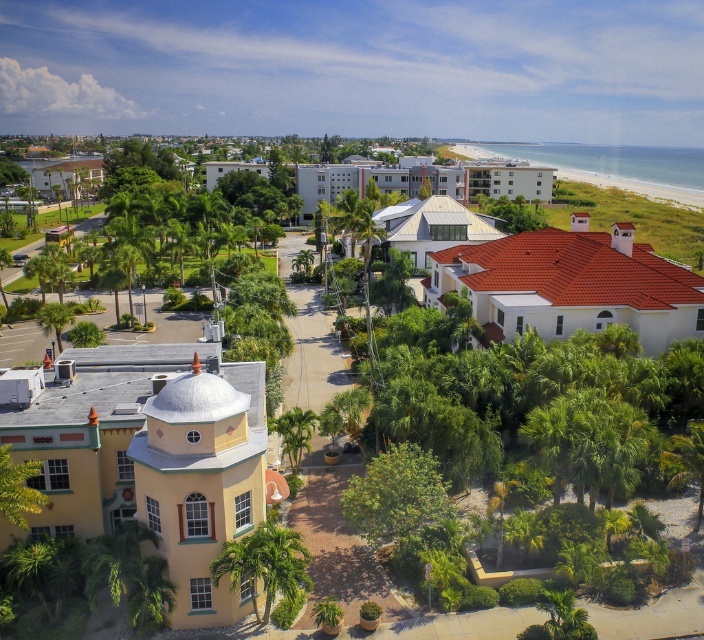
In the scene shown: Does white concrete building at center appear over white metal roof at center?

Yes, white concrete building at center is above white metal roof at center.

Who is positioned more to the left, white concrete building at center or white metal roof at center?

From the viewer's perspective, white concrete building at center appears more on the left side.

In order to click on white concrete building at center in this screenshot , I will do `click(372, 179)`.

Can you confirm if yellow matte building at lower left is positioned to the left of white textured building at center?

Incorrect, yellow matte building at lower left is not on the left side of white textured building at center.

Who is taller, yellow matte building at lower left or white textured building at center?

white textured building at center is taller.

Is point (251, 396) in front of point (213, 163)?

Yes, it is in front of point (213, 163).

This screenshot has height=640, width=704. I want to click on yellow matte building at lower left, so click(x=150, y=458).

Which is below, white tile roof at upper right or green leafy palm tree at lower left?

green leafy palm tree at lower left is below.

Where is `white tile roof at upper right`? white tile roof at upper right is located at coordinates (570, 284).